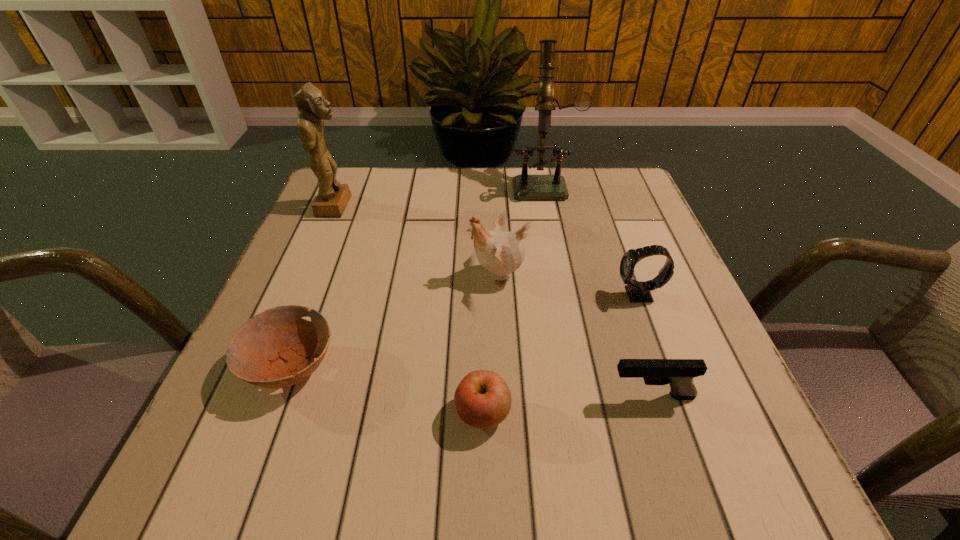
This screenshot has width=960, height=540. In order to click on unoccupied position between the bowl and the fifth shortest object in this screenshot , I will do `click(395, 321)`.

In order to click on free space between the apple and the figurine in this screenshot , I will do `click(409, 309)`.

Where is `object that stands as the closest to the watch`? The width and height of the screenshot is (960, 540). object that stands as the closest to the watch is located at coordinates (500, 252).

Where is `object that stands as the fourth closest to the pistol`? object that stands as the fourth closest to the pistol is located at coordinates (270, 350).

Identify the location of vacant space that satisfies the following two spatial constraints: 1. at the eyepiece of the microscope; 2. on the front-facing side of the figurine. (548, 206).

The height and width of the screenshot is (540, 960). I want to click on vacant space that satisfies the following two spatial constraints: 1. on the front-facing side of the figurine; 2. on the left side of the shortest object, so click(269, 367).

Identify the location of blank space that satisfies the following two spatial constraints: 1. on the front-facing side of the apple; 2. on the right side of the figurine. The width and height of the screenshot is (960, 540). (249, 413).

The height and width of the screenshot is (540, 960). Identify the location of vacant point that satisfies the following two spatial constraints: 1. at the eyepiece of the microscope; 2. at the beak of the bird. (562, 275).

At what (x,y) coordinates should I click in order to perform the action: click on vacant space that satisfies the following two spatial constraints: 1. at the beak of the bird; 2. on the front side of the apple. Please return your answer as a coordinate pair (x, y). Looking at the image, I should click on [504, 413].